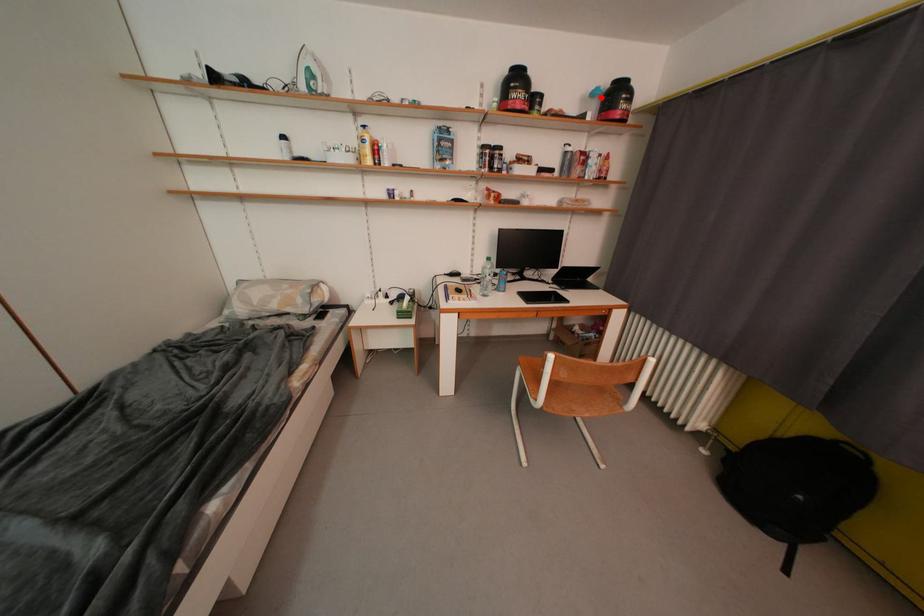
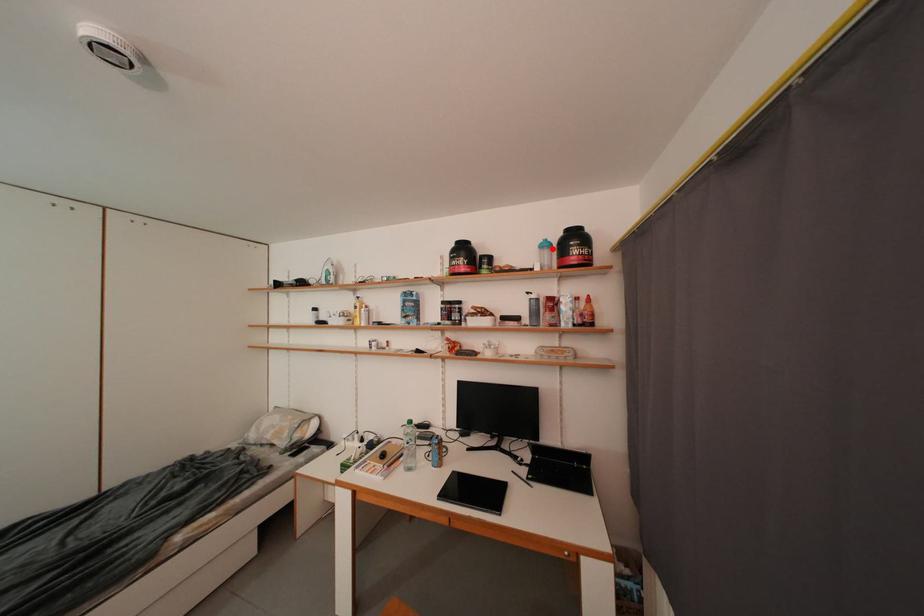
I am providing you with two images of the same scene from different viewpoints. A red point is marked on the first image and another point is marked on the second image. Does the point marked in image1 correspond to the same location as the one in image2?

Yes